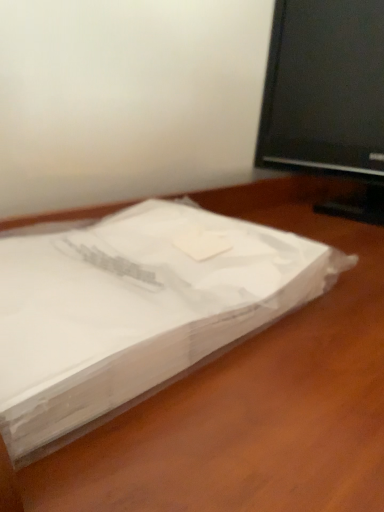
Question: From the image's perspective, is white paper at center above or below black glossy television at upper right?

Choices:
 (A) below
 (B) above

Answer: (A)

Question: Considering their positions, is white paper at center located in front of or behind black glossy television at upper right?

Choices:
 (A) front
 (B) behind

Answer: (A)

Question: Considering the positions of white paper at center and black glossy television at upper right in the image, is white paper at center bigger or smaller than black glossy television at upper right?

Choices:
 (A) small
 (B) big

Answer: (B)

Question: Would you say black glossy television at upper right is inside or outside white paper at center?

Choices:
 (A) outside
 (B) inside

Answer: (A)

Question: Considering their positions, is black glossy television at upper right located in front of or behind white paper at center?

Choices:
 (A) behind
 (B) front

Answer: (A)

Question: Is black glossy television at upper right to the left or to the right of white paper at center in the image?

Choices:
 (A) right
 (B) left

Answer: (A)

Question: From the image's perspective, is black glossy television at upper right located above or below white paper at center?

Choices:
 (A) below
 (B) above

Answer: (B)